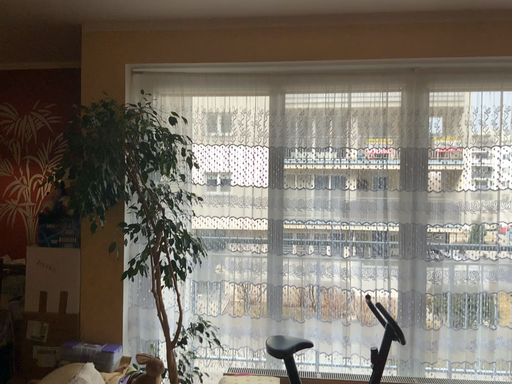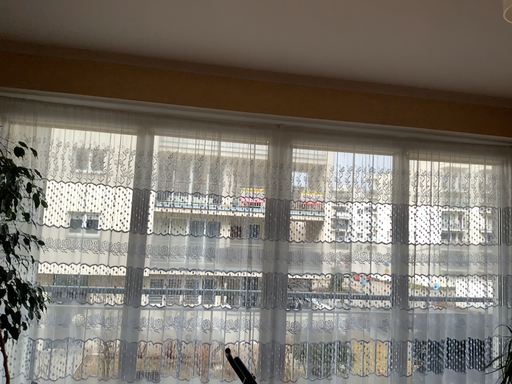
Question: Which way did the camera rotate in the video?

Choices:
 (A) rotated right
 (B) rotated left

Answer: (A)